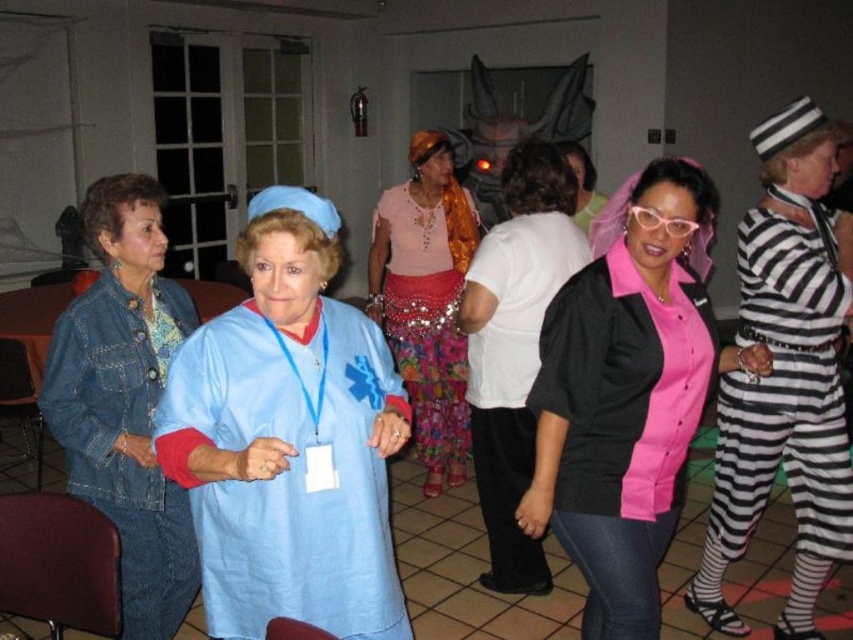
Is matte blue scrubs at center wider than pink matte shirt at center?

No.

Locate an element on the screen. This screenshot has width=853, height=640. matte blue scrubs at center is located at coordinates click(x=288, y=440).

What do you see at coordinates (288, 440) in the screenshot? I see `matte blue scrubs at center` at bounding box center [288, 440].

Locate an element on the screen. The width and height of the screenshot is (853, 640). matte blue scrubs at center is located at coordinates (288, 440).

Is point (202, 436) positioned after point (647, 208)?

No, (202, 436) is in front of (647, 208).

Is matte blue scrubs at center thinner than pink plastic glasses at center?

No.

Is point (321, 438) positioned before point (646, 225)?

Yes, point (321, 438) is in front of point (646, 225).

Image resolution: width=853 pixels, height=640 pixels. In order to click on matte blue scrubs at center in this screenshot , I will do `click(288, 440)`.

Does pink matte shirt at center appear under denim jacket at left?

No, pink matte shirt at center is not below denim jacket at left.

Who is lower down, pink matte shirt at center or denim jacket at left?

denim jacket at left is lower down.

Who is more forward, (548, 333) or (163, 298)?

Point (548, 333) is in front.

The width and height of the screenshot is (853, 640). Find the location of `pink matte shirt at center`. pink matte shirt at center is located at coordinates (625, 404).